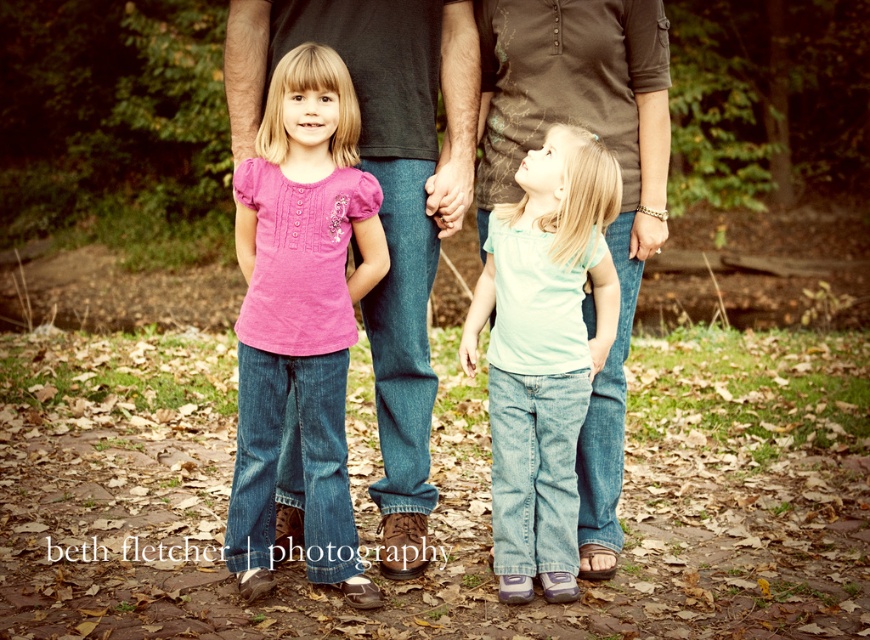
You are a photographer setting up a tripod in the center of the scene. You need to ensure that both the matte black shirt at center and the light blue denim jeans at center are visible in the frame. Given their height relationship, which object should you position closer to the camera to ensure both are fully visible?

The matte black shirt at center is taller than the light blue denim jeans at center. To ensure both are fully visible, position the matte black shirt at center closer to the camera so its full height can be captured without the light blue denim jeans at center blocking it.

You are standing at the point marked as point (439, 40) in the image. Your friend is standing 5 meters away from you. Can your friend see the parents of the two girls in the family portrait?

The point (439, 40) is 4.97 meters away from the viewer, which is approximately 5 meters. Since the parents are in the background and the girls are in the foreground, the parents would be visible to someone at that distance. Therefore, your friend can see the parents of the two girls in the family portrait.

Based on the scene description, where exactly is the matte black shirt at center located in terms of coordinates?

The matte black shirt at center is located at coordinates point (x=385, y=195).